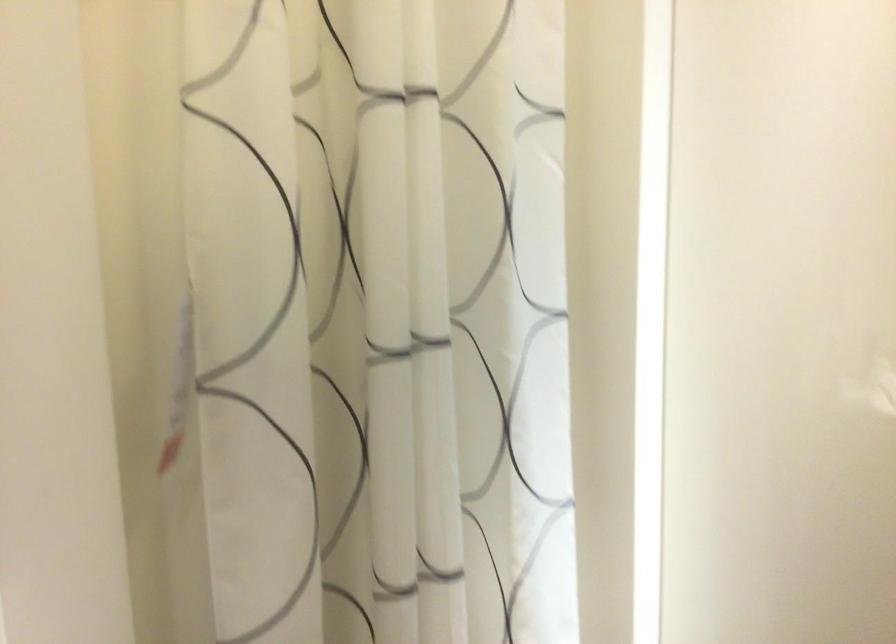
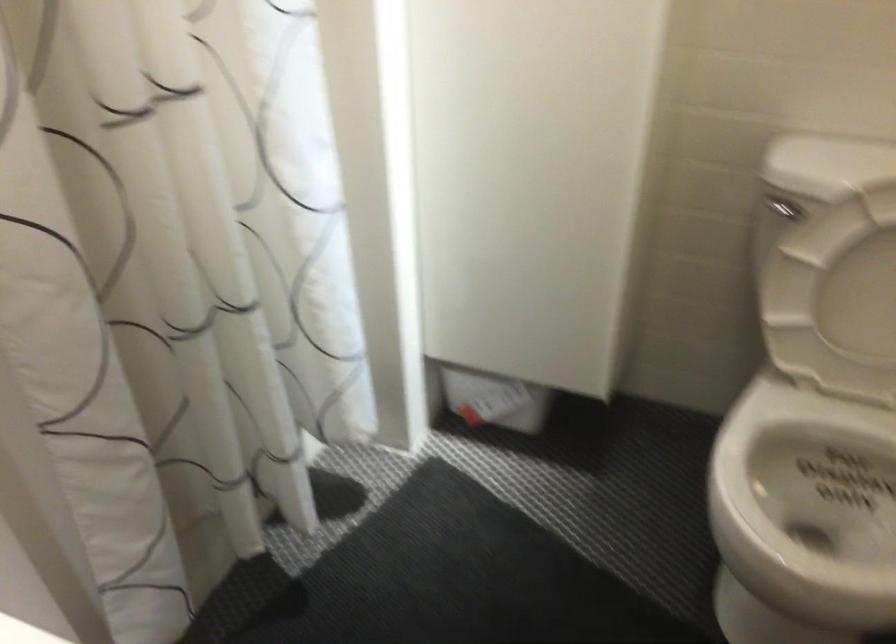
How did the camera likely rotate?

The rotation direction of the camera is right-down.